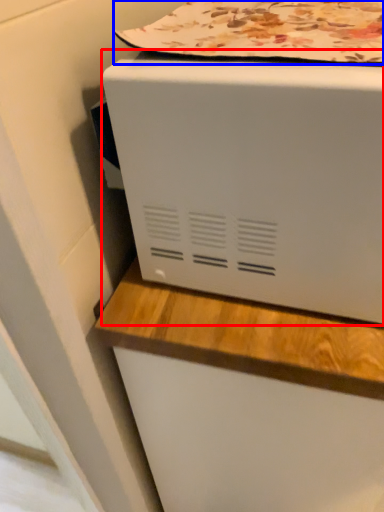
Question: Which object appears closest to the camera in this image, home appliance (highlighted by a red box) or blanket (highlighted by a blue box)?

Choices:
 (A) home appliance
 (B) blanket

Answer: (A)